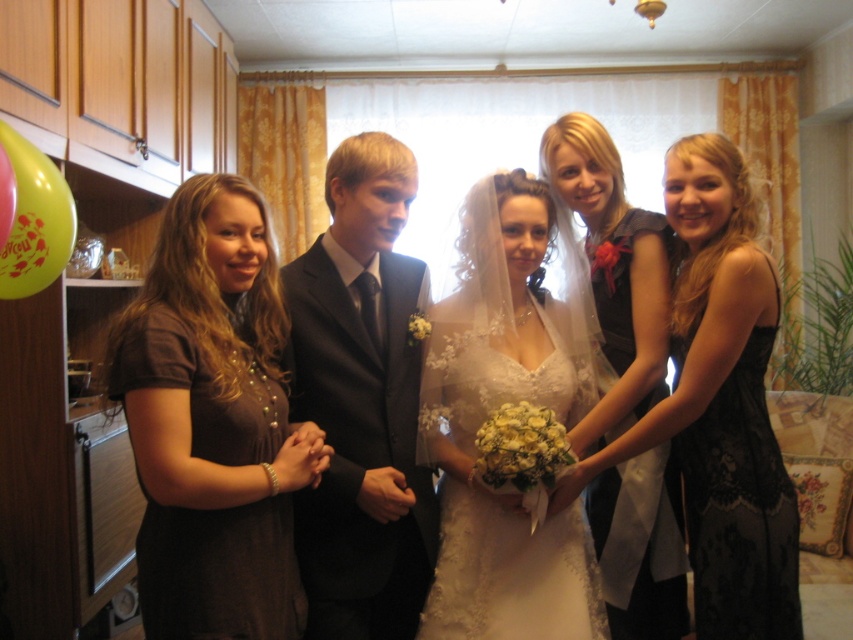
Question: Which object is farther from the camera taking this photo?

Choices:
 (A) black lace dress at right
 (B) brown matte dress at left
 (C) shiny black suit at center
 (D) white lace dress at center

Answer: (C)

Question: Does shiny black suit at center come in front of matte black dress at right?

Choices:
 (A) no
 (B) yes

Answer: (B)

Question: Does brown matte dress at left appear on the right side of matte black dress at right?

Choices:
 (A) yes
 (B) no

Answer: (B)

Question: Can you confirm if shiny black suit at center is thinner than matte white dress at center?

Choices:
 (A) yes
 (B) no

Answer: (A)

Question: Which of the following is the farthest from the observer?

Choices:
 (A) matte white dress at center
 (B) white lace dress at center

Answer: (A)

Question: Which of the following is the farthest from the observer?

Choices:
 (A) matte black dress at right
 (B) white lace dress at center

Answer: (A)